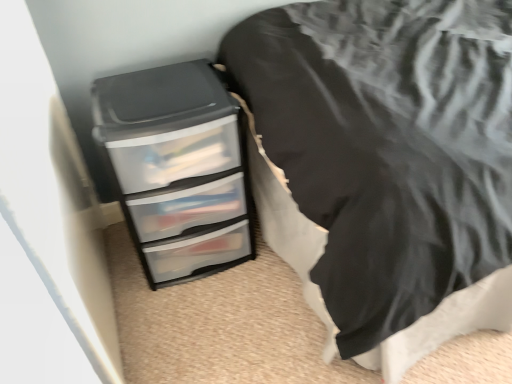
Find the location of a particular element. The height and width of the screenshot is (384, 512). free space above clear plastic chest of drawers at lower left (from a real-world perspective) is located at coordinates (161, 88).